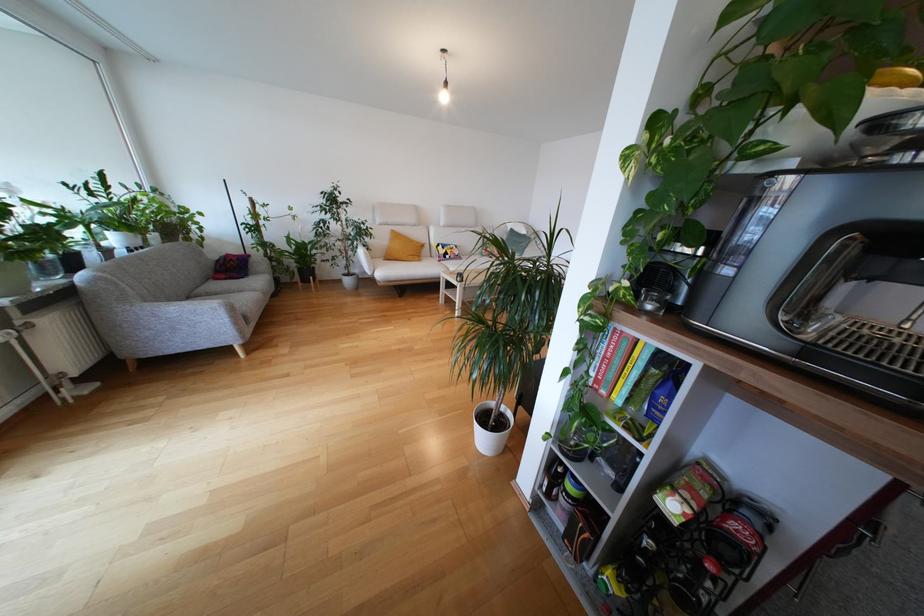
Which object does [665,392] point to?

This point indicates the blue book.